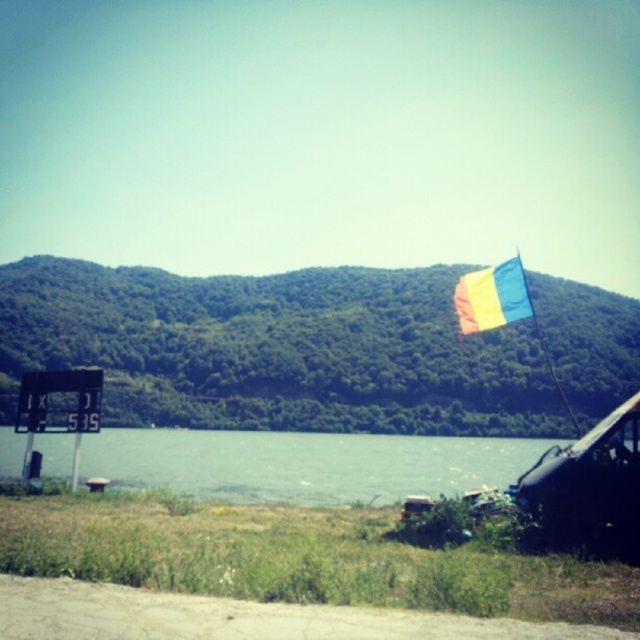
You are planning to set up a picnic blanket on the clear water at center. However, there is a multicolored fabric flag at upper right above it. Will the flag block sunlight from reaching the picnic area?

The clear water at center is positioned under the multicolored fabric flag at upper right, so the flag will cast a shadow over the picnic area, blocking some sunlight.

You are a hiker who wants to take a photo of the multicolored fabric flag at upper right and the clear water at center. From your current position, which object is positioned to the left of the other?

The clear water at center is to the left of the multicolored fabric flag at upper right.